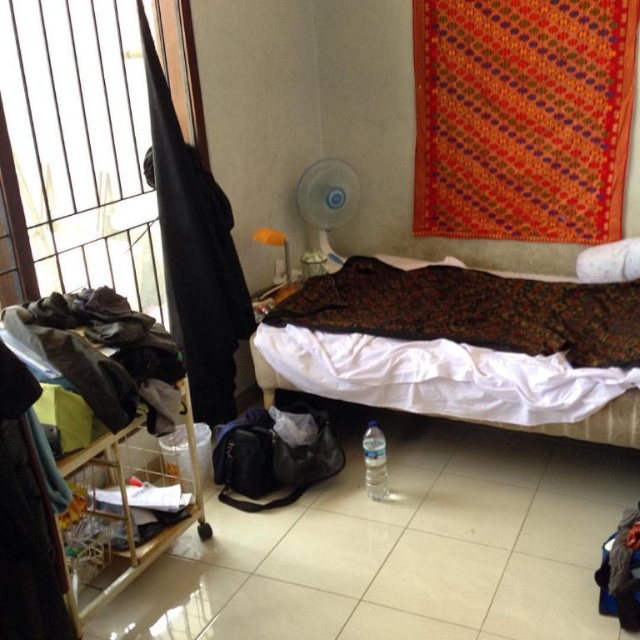
Question: Which object appears farthest from the camera in this image?

Choices:
 (A) red woven cloth at upper right
 (B) floral-patterned fabric at center
 (C) clear plastic bottle at center
 (D) patterned fabric bed at center

Answer: (A)

Question: Is red woven cloth at upper right below black fabric at left?

Choices:
 (A) no
 (B) yes

Answer: (A)

Question: Among these objects, which one is nearest to the camera?

Choices:
 (A) clear plastic bottle at center
 (B) white soft pillow at upper right
 (C) floral-patterned fabric at center

Answer: (C)

Question: Can you confirm if red woven cloth at upper right is wider than black fabric at left?

Choices:
 (A) no
 (B) yes

Answer: (B)

Question: Is patterned fabric bed at center thinner than white soft pillow at upper right?

Choices:
 (A) yes
 (B) no

Answer: (B)

Question: Which of the following is the closest to the observer?

Choices:
 (A) patterned fabric bed at center
 (B) white soft pillow at upper right

Answer: (A)